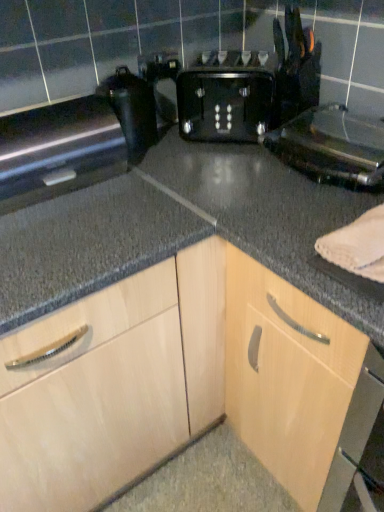
The image size is (384, 512). Find the location of `vacant area that is in front of black plastic toaster at center`. vacant area that is in front of black plastic toaster at center is located at coordinates (218, 165).